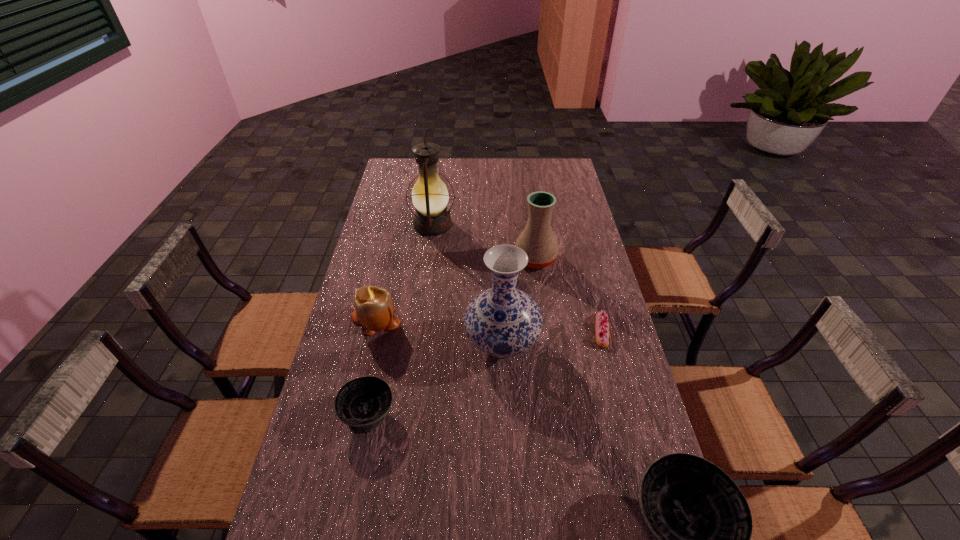
In the image, there is a desktop. Where is `blank space at the near edge`? This screenshot has height=540, width=960. blank space at the near edge is located at coordinates (581, 525).

Find the location of `vacant space at the left edge of the desktop`. vacant space at the left edge of the desktop is located at coordinates (409, 186).

In the image, there is a desktop. Where is `vacant space at the right edge`? vacant space at the right edge is located at coordinates click(x=590, y=408).

In the image, there is a desktop. Where is `vacant space at the far left corner`? The width and height of the screenshot is (960, 540). vacant space at the far left corner is located at coordinates (400, 158).

Locate an element on the screen. This screenshot has height=540, width=960. vacant space at the near left corner of the desktop is located at coordinates (281, 526).

The image size is (960, 540). In order to click on free space at the far right corner in this screenshot , I will do `click(564, 164)`.

Identify the location of vacant area at the near right corner of the desktop. This screenshot has width=960, height=540. [636, 522].

Locate an element on the screen. The image size is (960, 540). free space between the sixth farthest object and the oil lamp is located at coordinates (400, 319).

You are a GUI agent. You are given a task and a screenshot of the screen. Output one action in this format:
    pyautogui.click(x=<x>, y=<y>)
    Task: Click on the blank region between the third tallest object and the candle
    Image resolution: width=960 pixels, height=540 pixels.
    Given the screenshot: What is the action you would take?
    pyautogui.click(x=456, y=289)

This screenshot has width=960, height=540. What are the coordinates of `vacant space in between the second tallest object and the fourth tallest object` in the screenshot? It's located at (439, 331).